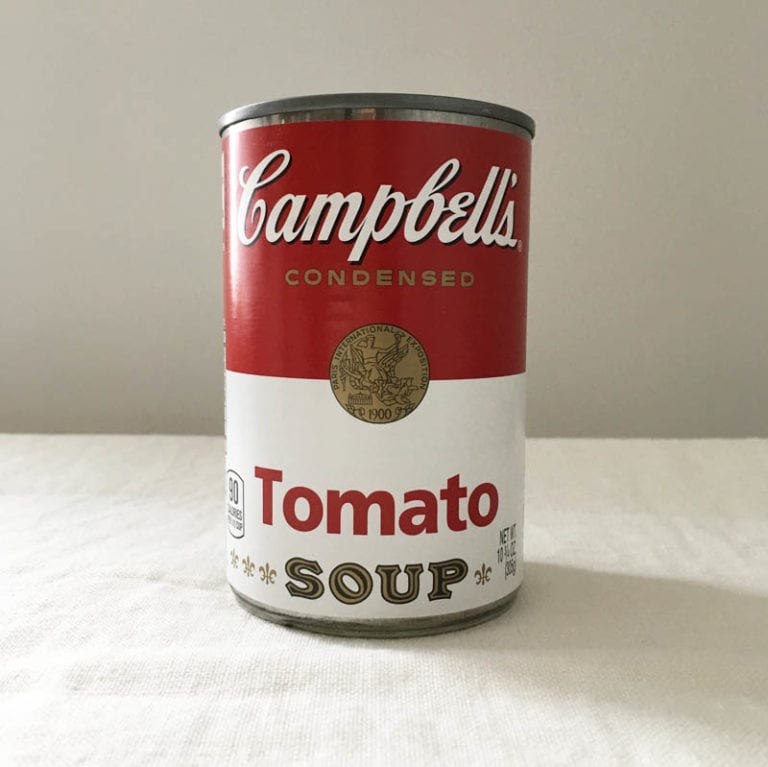
Where is `white counter`? This screenshot has width=768, height=767. white counter is located at coordinates (184, 636).